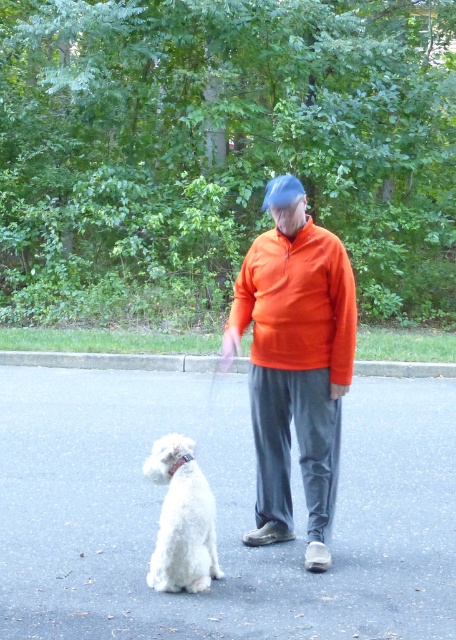
Question: Which point appears closest to the camera in this image?

Choices:
 (A) (331, 244)
 (B) (211, 506)
 (C) (274, 228)

Answer: (B)

Question: Which point appears closest to the camera in this image?

Choices:
 (A) (300, 298)
 (B) (295, 195)
 (C) (169, 492)

Answer: (C)

Question: Observing the image, what is the correct spatial positioning of orange fleece jacket at center in reference to white fluffy dog at lower left?

Choices:
 (A) below
 (B) above

Answer: (B)

Question: Does orange fleece jacket at center have a greater width compared to white fluffy dog at lower left?

Choices:
 (A) yes
 (B) no

Answer: (A)

Question: Is orange fleece jacket at center wider than orange fleece sweatshirt at center?

Choices:
 (A) yes
 (B) no

Answer: (A)

Question: Which of the following is the closest to the observer?

Choices:
 (A) orange fleece jacket at center
 (B) orange fleece sweatshirt at center
 (C) white fluffy dog at lower left

Answer: (C)